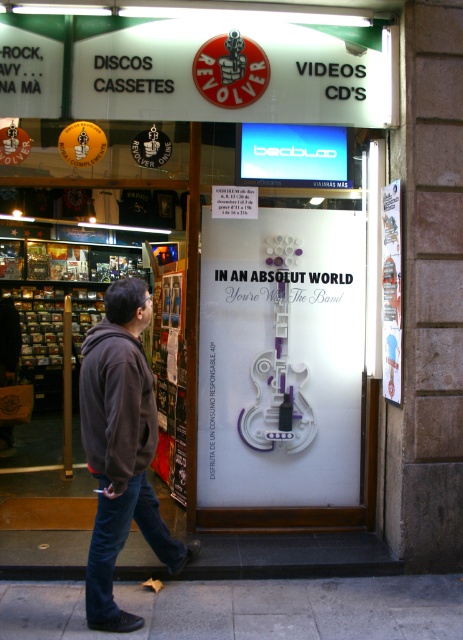
Identify the location of gray concrete pavement at lower center. (248, 609).

Does gray concrete pavement at lower center have a larger size compared to dark gray hoodie at center?

Actually, gray concrete pavement at lower center might be smaller than dark gray hoodie at center.

Which is behind, point (345, 630) or point (131, 429)?

The point (345, 630) is behind.

In order to click on gray concrete pavement at lower center in this screenshot , I will do `click(248, 609)`.

Can you confirm if white paper guitar at center is thinner than gray concrete pavement at lower center?

Correct, white paper guitar at center's width is less than gray concrete pavement at lower center's.

Is white paper guitar at center below gray concrete pavement at lower center?

Actually, white paper guitar at center is above gray concrete pavement at lower center.

Which is in front, point (311, 412) or point (401, 632)?

Point (401, 632) is in front.

You are a GUI agent. You are given a task and a screenshot of the screen. Output one action in this format:
    pyautogui.click(x=<x>, y=<y>)
    Task: Click on the white paper guitar at center
    Image resolution: width=463 pixels, height=640 pixels.
    Given the screenshot: What is the action you would take?
    pyautogui.click(x=281, y=358)

Who is higher up, dark gray hoodie at center or dark blue denim jeans at lower left?

dark gray hoodie at center is higher up.

Which of these two, dark gray hoodie at center or dark blue denim jeans at lower left, stands shorter?

dark blue denim jeans at lower left

Between point (149, 369) and point (127, 520), which one is positioned in front?

Point (127, 520) is in front.

What are the coordinates of `dark gray hoodie at center` in the screenshot? It's located at [x=120, y=449].